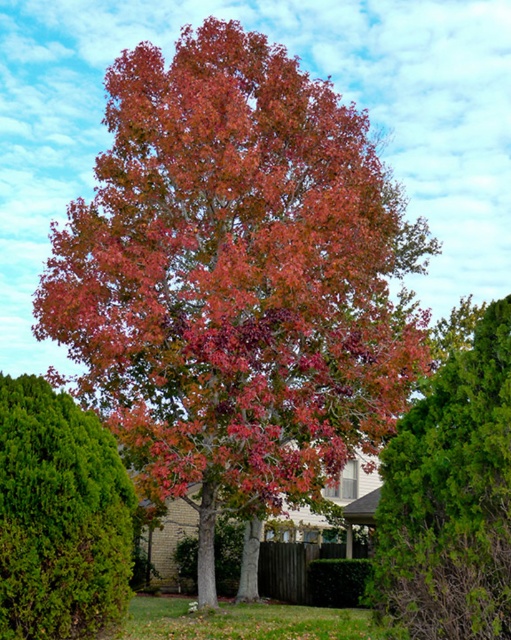
Identify the location of green textured bush at right. The image size is (511, 640). (451, 499).

Is the position of green textured bush at right less distant than that of green textured bush at lower left?

Yes, it is in front of green textured bush at lower left.

The height and width of the screenshot is (640, 511). In order to click on green textured bush at right in this screenshot , I will do [x=451, y=499].

Find the location of `green textured bush at right`. green textured bush at right is located at coordinates (451, 499).

Is point (107, 524) farther from camera compared to point (351, 580)?

No, it is not.

Describe the element at coordinates (59, 516) in the screenshot. The image size is (511, 640). I see `green textured bush at lower left` at that location.

Describe the element at coordinates (59, 516) in the screenshot. I see `green textured bush at lower left` at that location.

Identify the location of green textured bush at lower left. The image size is (511, 640). coord(59,516).

Who is positioned more to the left, green textured bush at right or green leafy hedge at lower center?

Positioned to the left is green leafy hedge at lower center.

Does green textured bush at right lie behind green leafy hedge at lower center?

That is False.

What do you see at coordinates (451, 499) in the screenshot? I see `green textured bush at right` at bounding box center [451, 499].

Locate an element on the screen. Image resolution: width=511 pixels, height=640 pixels. green textured bush at right is located at coordinates (451, 499).